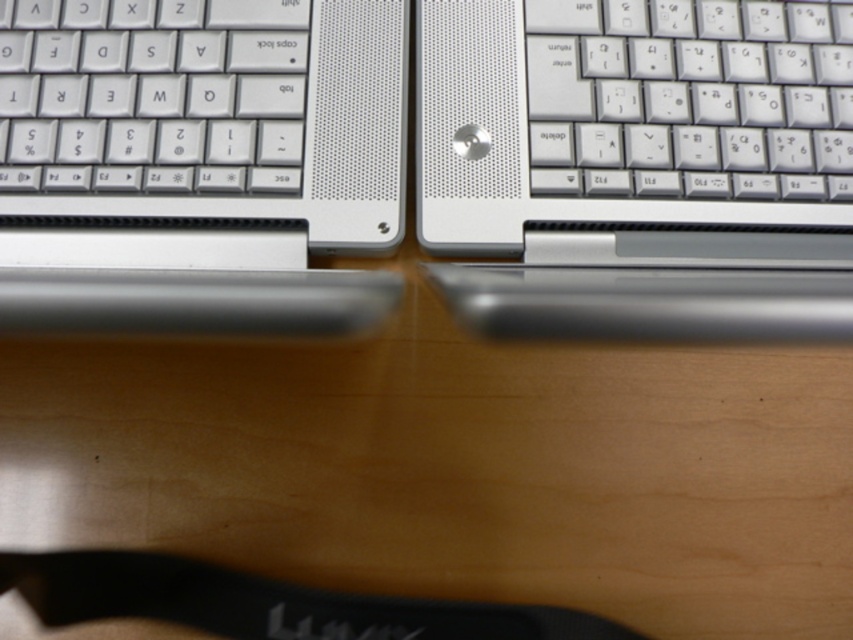
Question: Which of the following is the farthest from the observer?

Choices:
 (A) satin silver laptop at left
 (B) white plastic keyboard at left

Answer: (B)

Question: Does satin silver keyboard at center appear under white plastic keyboard at left?

Choices:
 (A) yes
 (B) no

Answer: (A)

Question: Which object is farther from the camera taking this photo?

Choices:
 (A) satin silver keyboard at center
 (B) satin silver laptop at left
 (C) white plastic keyboard at left

Answer: (C)

Question: Is satin silver laptop at left to the right of white plastic keyboard at upper right from the viewer's perspective?

Choices:
 (A) yes
 (B) no

Answer: (B)

Question: Can you confirm if satin silver keyboard at center is smaller than white plastic keyboard at upper right?

Choices:
 (A) no
 (B) yes

Answer: (A)

Question: Which point is closer to the camera?

Choices:
 (A) satin silver laptop at left
 (B) satin silver keyboard at center
 (C) white plastic keyboard at left

Answer: (A)